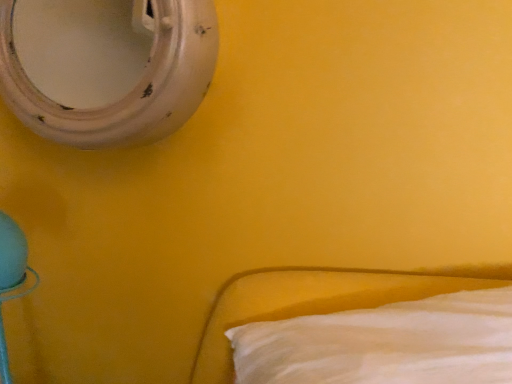
The image size is (512, 384). Describe the element at coordinates (106, 67) in the screenshot. I see `white glossy mirror at upper left` at that location.

In order to click on white glossy mirror at upper left in this screenshot , I will do `click(106, 67)`.

At what (x,y) coordinates should I click in order to perform the action: click on white glossy mirror at upper left. Please return your answer as a coordinate pair (x, y). This screenshot has height=384, width=512. Looking at the image, I should click on (106, 67).